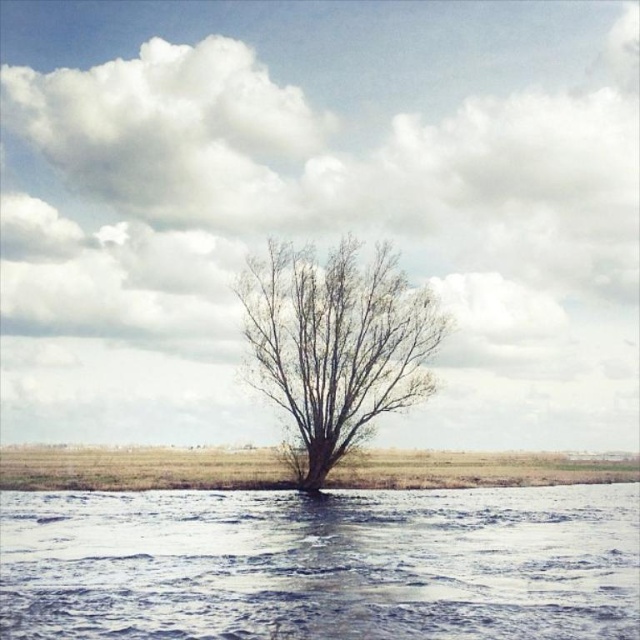
Can you confirm if translucent ice at lower center is smaller than brown grass at center?

Yes.

Does translucent ice at lower center appear under brown grass at center?

No.

Which is behind, point (112, 541) or point (36, 472)?

The point (36, 472) is behind.

Locate an element on the screen. The image size is (640, 640). translucent ice at lower center is located at coordinates (321, 564).

From the picture: Does bare branches at center appear on the left side of brown grass at center?

Yes, bare branches at center is to the left of brown grass at center.

Does bare branches at center have a greater width compared to brown grass at center?

No, bare branches at center is not wider than brown grass at center.

Does point (410, 390) come behind point (541, 480)?

No, it is not.

You are a GUI agent. You are given a task and a screenshot of the screen. Output one action in this format:
    pyautogui.click(x=<x>, y=<y>)
    Task: Click on the bare branches at center
    This screenshot has width=640, height=640.
    Given the screenshot: What is the action you would take?
    pyautogui.click(x=336, y=342)

Between translucent ice at lower center and bare branches at center, which one is positioned higher?

Positioned higher is bare branches at center.

Locate an element on the screen. translucent ice at lower center is located at coordinates 321,564.